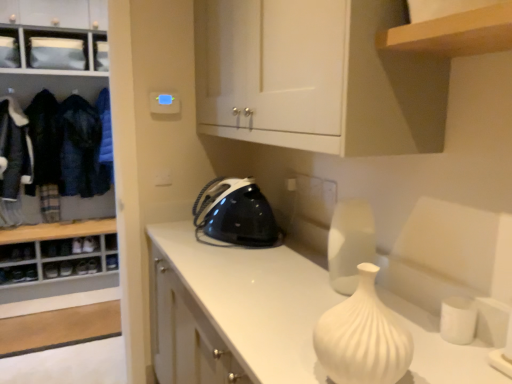
Question: From the image's perspective, is white matte cabinet at upper center, the first cabinetry from the front, below black glossy iron at center?

Choices:
 (A) no
 (B) yes

Answer: (A)

Question: Would you say white matte cabinet at upper center, the first cabinetry from the front, is outside black glossy iron at center?

Choices:
 (A) no
 (B) yes

Answer: (B)

Question: From a real-world perspective, is white matte cabinet at upper center, which is the 2th cabinetry from back to front, beneath black glossy iron at center?

Choices:
 (A) yes
 (B) no

Answer: (B)

Question: Is white matte cabinet at upper center, which is the 2th cabinetry from back to front, positioned in front of black glossy iron at center?

Choices:
 (A) yes
 (B) no

Answer: (A)

Question: Does white matte cabinet at upper center, the first cabinetry from the front, have a lesser width compared to black glossy iron at center?

Choices:
 (A) no
 (B) yes

Answer: (B)

Question: From a real-world perspective, is white matte cabinet at upper center, arranged as the 1th cabinetry when viewed from the right, above or below white wood cabinet at left, acting as the 2th cabinetry starting from the front?

Choices:
 (A) above
 (B) below

Answer: (A)

Question: Considering the positions of point (295, 51) and point (98, 240), is point (295, 51) closer or farther from the camera than point (98, 240)?

Choices:
 (A) farther
 (B) closer

Answer: (B)

Question: Based on their positions, is white matte cabinet at upper center, the first cabinetry from the front, located to the left or right of white wood cabinet at left, the first cabinetry viewed from the left?

Choices:
 (A) left
 (B) right

Answer: (B)

Question: Is white matte cabinet at upper center, the first cabinetry from the front, wider or thinner than white wood cabinet at left, acting as the 2th cabinetry starting from the front?

Choices:
 (A) wide
 (B) thin

Answer: (B)

Question: Based on their positions, is white glossy countertop at center located to the left or right of white matte vase at center?

Choices:
 (A) right
 (B) left

Answer: (B)

Question: Looking at the image, does white glossy countertop at center seem bigger or smaller compared to white matte vase at center?

Choices:
 (A) small
 (B) big

Answer: (B)

Question: In the image, is white glossy countertop at center positioned in front of or behind white matte vase at center?

Choices:
 (A) behind
 (B) front

Answer: (B)

Question: From the image's perspective, is white glossy countertop at center positioned above or below white matte vase at center?

Choices:
 (A) above
 (B) below

Answer: (B)

Question: From a real-world perspective, is dark blue woolen jacket at left, the third clothing when ordered from right to left, positioned above or below white matte vase at center?

Choices:
 (A) below
 (B) above

Answer: (B)

Question: Considering their positions, is dark blue woolen jacket at left, the third clothing when ordered from right to left, located in front of or behind white matte vase at center?

Choices:
 (A) front
 (B) behind

Answer: (B)